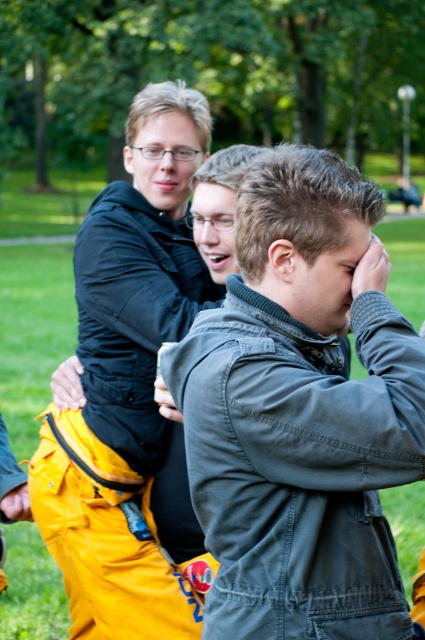
The height and width of the screenshot is (640, 425). Describe the element at coordinates (300, 412) in the screenshot. I see `dark gray fabric jacket at center` at that location.

Find the location of a particular element. dark gray fabric jacket at center is located at coordinates (300, 412).